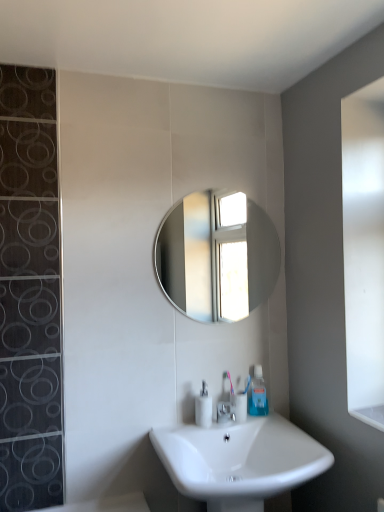
Question: Would you say clear plastic toothpaste tube at lower center is inside or outside shiny silver mirror at center?

Choices:
 (A) inside
 (B) outside

Answer: (B)

Question: From the image's perspective, is clear plastic toothpaste tube at lower center located above or below shiny silver mirror at center?

Choices:
 (A) below
 (B) above

Answer: (A)

Question: Which is farther from the white glossy soap dispenser at center?

Choices:
 (A) silver metallic faucet at center
 (B) clear plastic toothpaste tube at lower center
 (C) white glossy sink at lower center
 (D) shiny silver mirror at center

Answer: (D)

Question: Considering the real-world distances, which object is closest to the clear plastic toothpaste tube at lower center?

Choices:
 (A) white glossy soap dispenser at center
 (B) silver metallic faucet at center
 (C) white glossy sink at lower center
 (D) shiny silver mirror at center

Answer: (B)